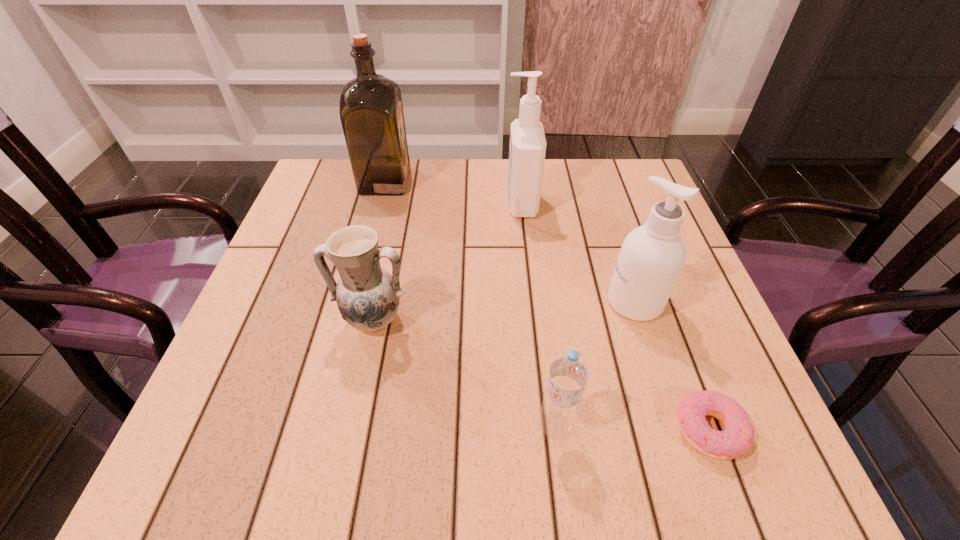
What are the coordinates of `vacant space at the near left corner of the desktop` in the screenshot? It's located at (228, 467).

I want to click on vacant space at the far right corner, so click(x=619, y=212).

Identify the location of vacant space that is in between the shortest object and the pottery. Image resolution: width=960 pixels, height=540 pixels. (541, 375).

Identify the location of free point between the third tallest object and the pottery. Image resolution: width=960 pixels, height=540 pixels. (504, 311).

Image resolution: width=960 pixels, height=540 pixels. In order to click on vacant space that is in between the liquor and the farther cleansing agent in this screenshot , I will do `click(453, 192)`.

At what (x,y) coordinates should I click in order to perform the action: click on empty location between the pottery and the farther cleansing agent. Please return your answer as a coordinate pair (x, y). Looking at the image, I should click on (447, 262).

The image size is (960, 540). I want to click on empty space that is in between the liquor and the right cleansing agent, so click(x=510, y=241).

The width and height of the screenshot is (960, 540). What are the coordinates of `free area in between the doughnut and the left cleansing agent` in the screenshot? It's located at (614, 317).

I want to click on vacant space that's between the farther cleansing agent and the shortest object, so click(614, 317).

Identify the location of vacant space that's between the water bottle and the doughnut. This screenshot has width=960, height=540. (633, 428).